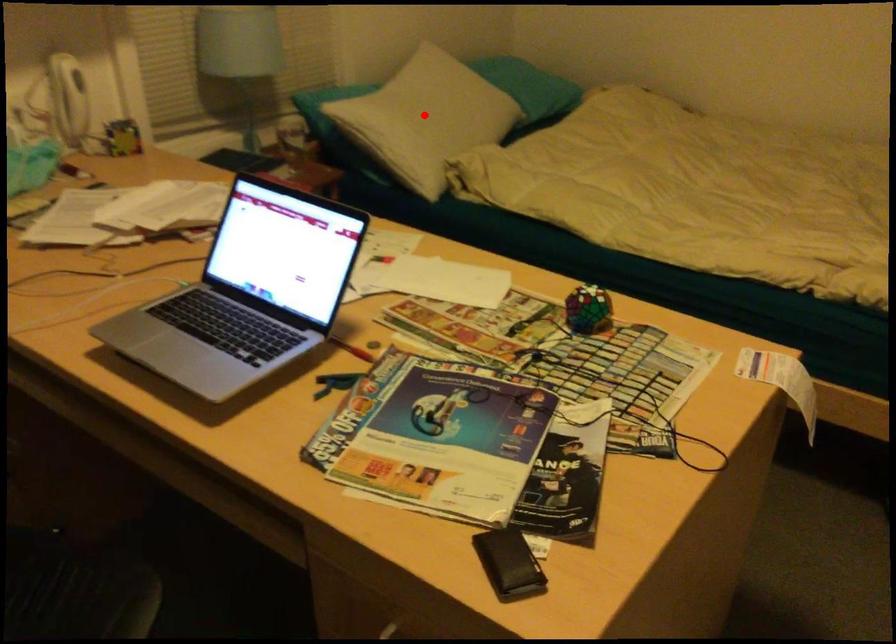
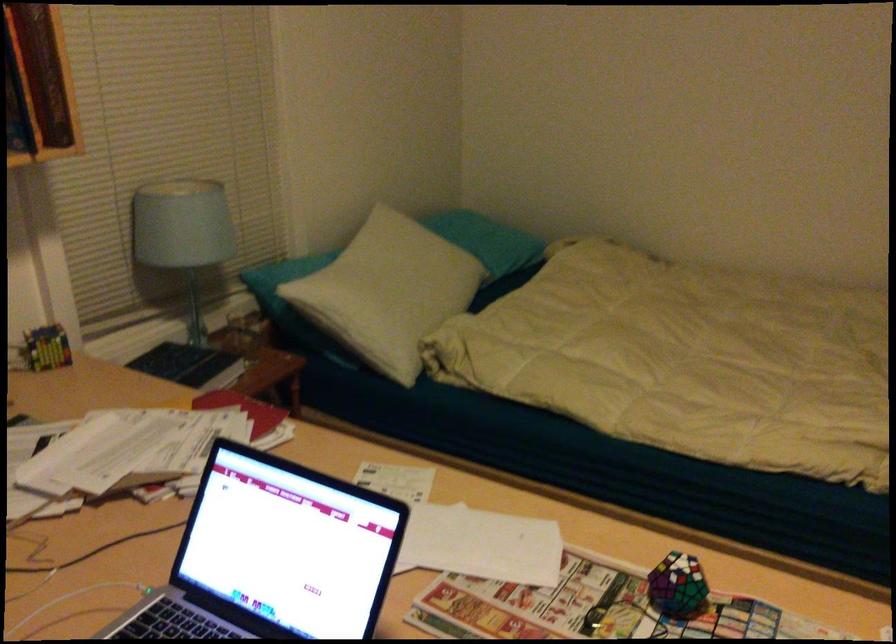
Where in the second image is the point corresponding to the highlighted location from the first image?

(391, 285)